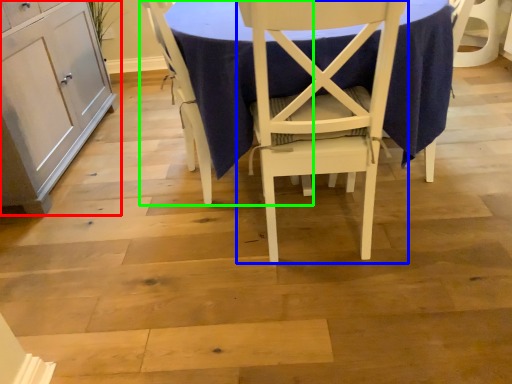
Question: Estimate the real-world distances between objects in this image. Which object is farther from cabinetry (highlighted by a red box), chair (highlighted by a blue box) or chair (highlighted by a green box)?

Choices:
 (A) chair
 (B) chair

Answer: (A)